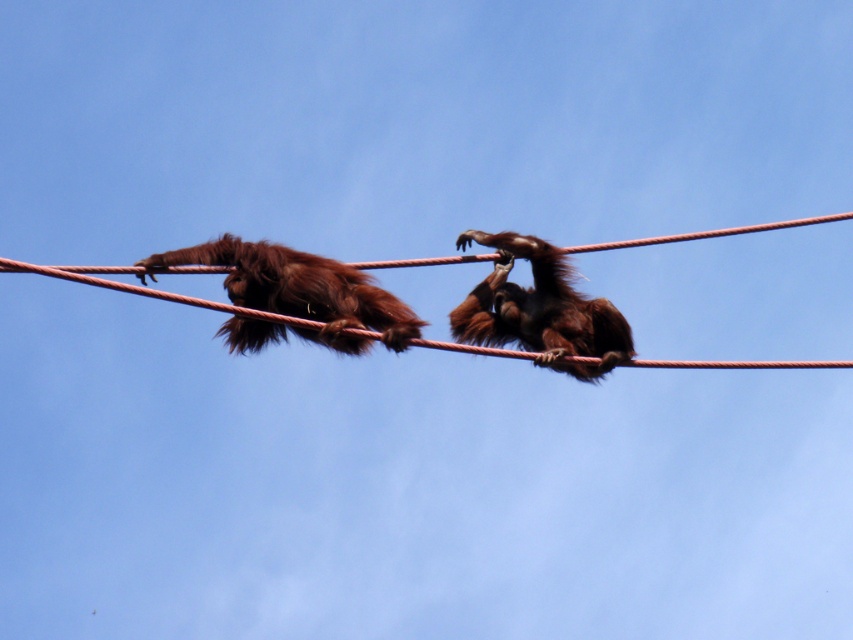
Question: Which of the following is the farthest from the observer?

Choices:
 (A) (598, 307)
 (B) (315, 292)

Answer: (A)

Question: Which of the following is the closest to the observer?

Choices:
 (A) (323, 298)
 (B) (523, 316)

Answer: (A)

Question: Does brown furry monkey at upper left have a lesser width compared to brown furry monkey at center?

Choices:
 (A) no
 (B) yes

Answer: (A)

Question: Which of the following is the closest to the observer?

Choices:
 (A) (258, 260)
 (B) (540, 289)

Answer: (A)

Question: Can you confirm if brown furry monkey at upper left is smaller than brown furry monkey at center?

Choices:
 (A) yes
 (B) no

Answer: (A)

Question: Can you confirm if brown furry monkey at upper left is bigger than brown furry monkey at center?

Choices:
 (A) no
 (B) yes

Answer: (A)